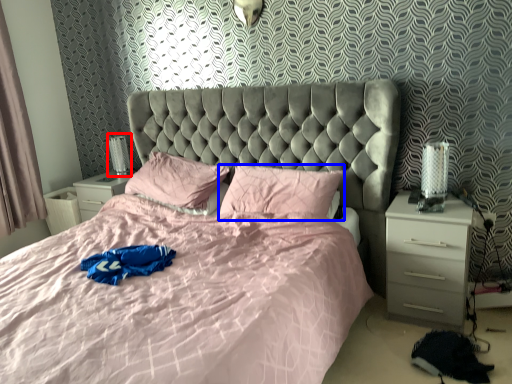
Question: Which of the following is the farthest to the observer, table lamp (highlighted by a red box) or pillow (highlighted by a blue box)?

Choices:
 (A) table lamp
 (B) pillow

Answer: (A)